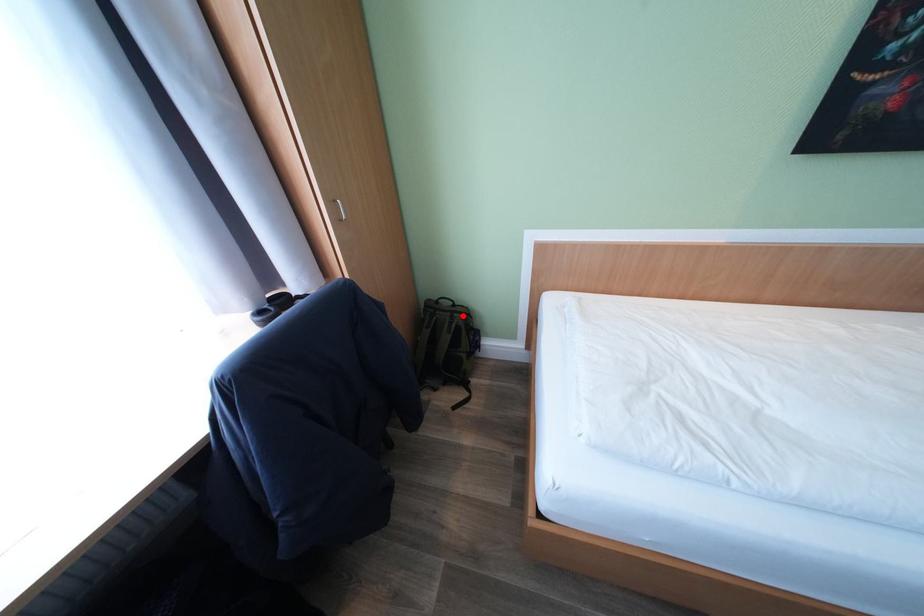
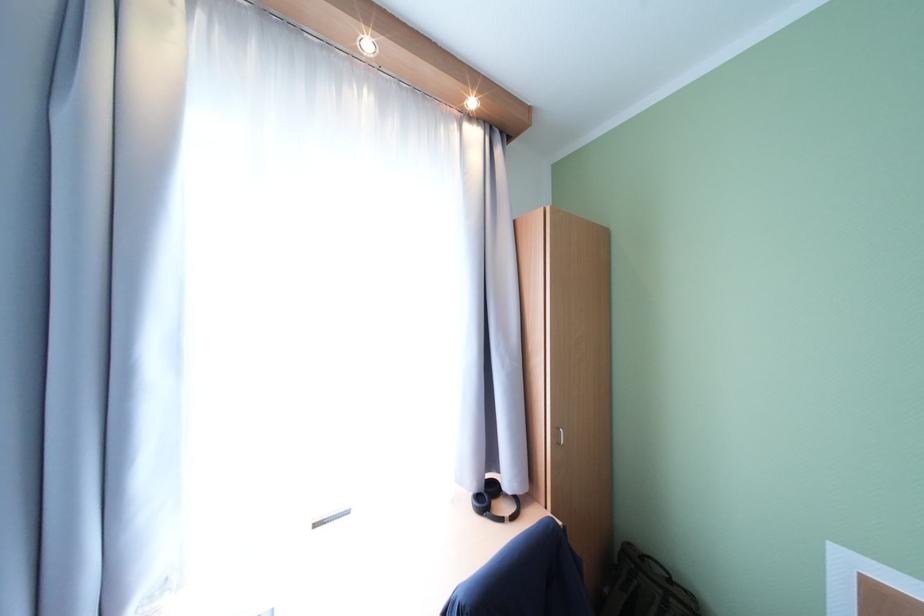
Question: A red point is marked in image1. In image2, is the corresponding 3D point closer to the camera or farther? Reply with the corresponding letter.

Choices:
 (A) The corresponding 3D point is closer.
 (B) The corresponding 3D point is farther.

Answer: (A)